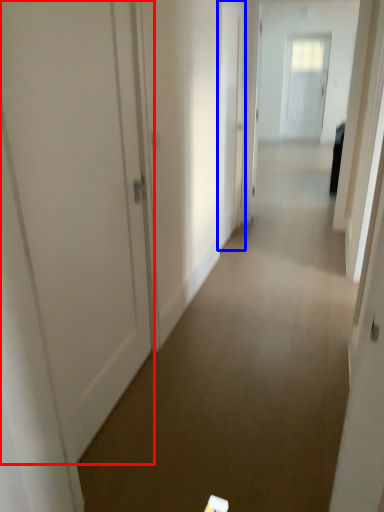
Question: Which of the following is the farthest to the observer, door (highlighted by a red box) or door (highlighted by a blue box)?

Choices:
 (A) door
 (B) door

Answer: (B)